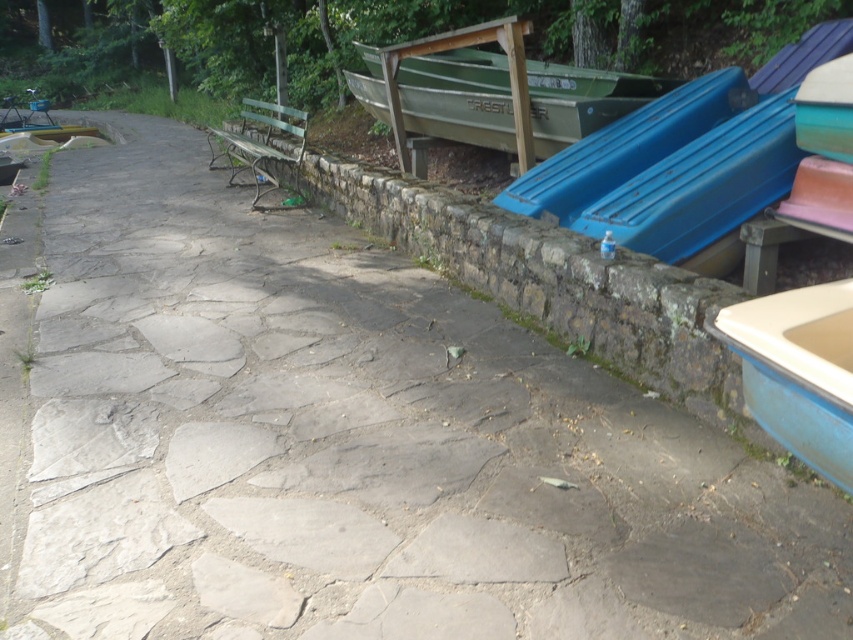
Question: Can you confirm if blue metallic boat at right is thinner than green wooden bench at center?

Choices:
 (A) no
 (B) yes

Answer: (A)

Question: Estimate the real-world distances between objects in this image. Which object is farther from the blue metallic boat at right?

Choices:
 (A) green wooden bench at center
 (B) green matte boat at upper center

Answer: (A)

Question: Is green matte boat at upper center to the left of green wooden bench at center from the viewer's perspective?

Choices:
 (A) no
 (B) yes

Answer: (A)

Question: Which of the following is the farthest from the observer?

Choices:
 (A) (270, 102)
 (B) (647, 234)

Answer: (A)

Question: Which is nearer to the blue metallic boat at right?

Choices:
 (A) green wooden bench at center
 (B) green matte boat at upper center

Answer: (B)

Question: Is blue metallic boat at right further to the viewer compared to green matte boat at upper center?

Choices:
 (A) no
 (B) yes

Answer: (A)